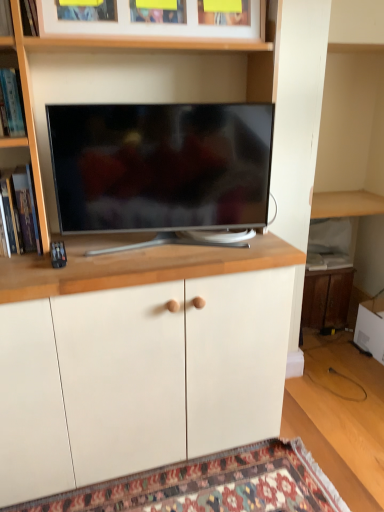
Identify the location of free point in front of wooden bookshelf at left, the 3th shelf from the top. Image resolution: width=384 pixels, height=512 pixels. (25, 264).